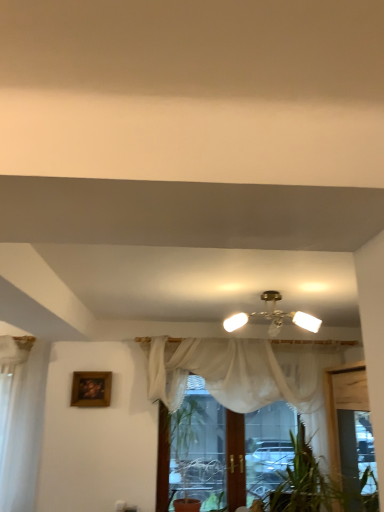
Question: Would you consider wooden framed painting at upper left to be distant from white sheer curtain at center?

Choices:
 (A) yes
 (B) no

Answer: (A)

Question: Could you tell me if wooden framed painting at upper left is turned towards white sheer curtain at center?

Choices:
 (A) yes
 (B) no

Answer: (B)

Question: Is wooden framed painting at upper left taller than white sheer curtain at center?

Choices:
 (A) no
 (B) yes

Answer: (A)

Question: Considering the relative positions of wooden framed painting at upper left and white sheer curtain at center in the image provided, is wooden framed painting at upper left to the right of white sheer curtain at center from the viewer's perspective?

Choices:
 (A) no
 (B) yes

Answer: (A)

Question: Is wooden framed painting at upper left facing away from white sheer curtain at center?

Choices:
 (A) yes
 (B) no

Answer: (B)

Question: Is wooden framed painting at upper left located outside white sheer curtain at center?

Choices:
 (A) yes
 (B) no

Answer: (A)

Question: Does matte brass chandelier at center have a smaller size compared to white sheer curtain at center?

Choices:
 (A) yes
 (B) no

Answer: (A)

Question: Is matte brass chandelier at center further to camera compared to white sheer curtain at center?

Choices:
 (A) no
 (B) yes

Answer: (A)

Question: Does matte brass chandelier at center turn towards white sheer curtain at center?

Choices:
 (A) yes
 (B) no

Answer: (B)

Question: Does matte brass chandelier at center contain white sheer curtain at center?

Choices:
 (A) yes
 (B) no

Answer: (B)

Question: From a real-world perspective, is matte brass chandelier at center positioned over white sheer curtain at center based on gravity?

Choices:
 (A) no
 (B) yes

Answer: (B)

Question: From a real-world perspective, does matte brass chandelier at center sit lower than white sheer curtain at center?

Choices:
 (A) no
 (B) yes

Answer: (A)

Question: Could you tell me if white sheer curtain at center is facing matte brass chandelier at center?

Choices:
 (A) no
 (B) yes

Answer: (B)